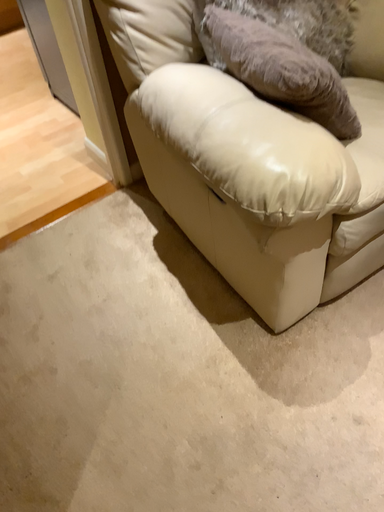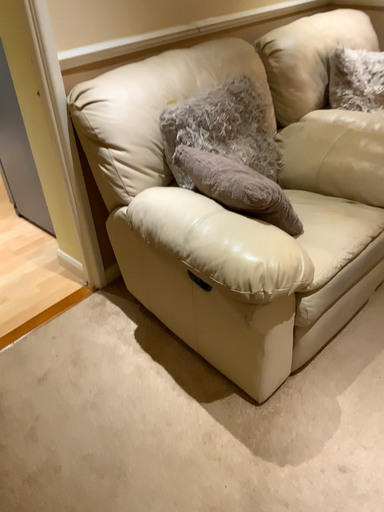
Question: Which way did the camera rotate in the video?

Choices:
 (A) rotated right
 (B) rotated left

Answer: (A)